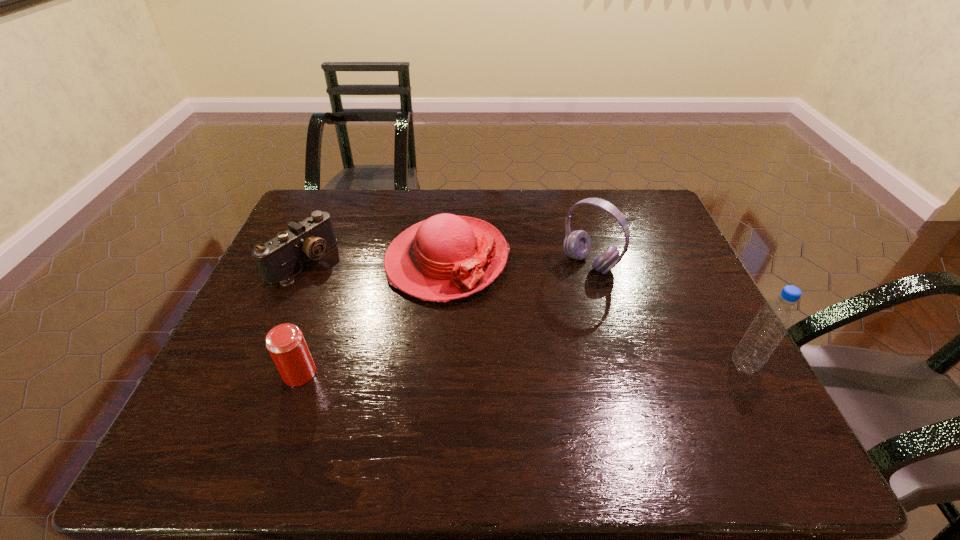
The image size is (960, 540). Identify the location of beer can. (285, 342).

Find the location of a particular element. The image size is (960, 540). the rightmost object is located at coordinates (773, 320).

Image resolution: width=960 pixels, height=540 pixels. Identify the location of camera. (278, 258).

Where is `headset`? headset is located at coordinates (577, 244).

You are a GUI agent. You are given a task and a screenshot of the screen. Output one action in this format:
    pyautogui.click(x=<x>, y=<y>)
    Task: Click on the second tallest object
    The width and height of the screenshot is (960, 540).
    Given the screenshot: What is the action you would take?
    pyautogui.click(x=577, y=244)

Locate an element on the screen. This screenshot has height=540, width=960. the third object from left to right is located at coordinates (445, 257).

In order to click on vacant space located on the back of the beer can in this screenshot , I will do `click(313, 336)`.

Where is `vacant point located on the left of the water bottle`? Image resolution: width=960 pixels, height=540 pixels. vacant point located on the left of the water bottle is located at coordinates (634, 366).

Image resolution: width=960 pixels, height=540 pixels. I want to click on free location located 0.350m on the front-facing side of the camera, so click(x=415, y=334).

Locate an element on the screen. This screenshot has height=540, width=960. vacant region located 0.140m on the front-facing side of the camera is located at coordinates (354, 298).